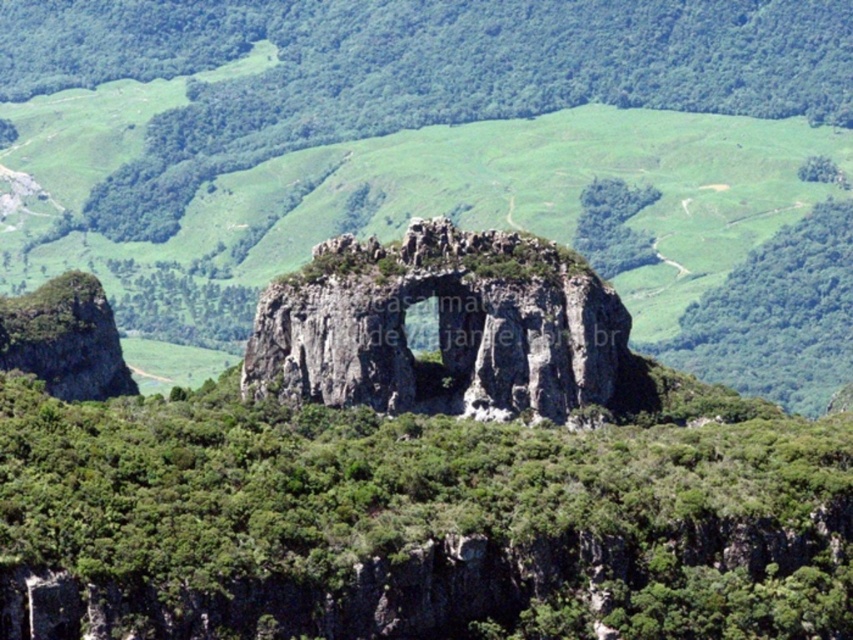
You are a hiker who wants to take a photo of the rugged stone arch at center and the green leafy vegetation at center. Which object should you focus on first if you want to capture both in a single frame without moving the camera?

The rugged stone arch at center has a greater height compared to the green leafy vegetation at center, so you should focus on the rugged stone arch at center first to ensure its full height is captured in the frame.

You are a hiker planning to pass through the arches in the landscape. You have a backpack that is 1.5 meters wide. Can you determine which arch, the rugged stone arch at center or the gray rocky arch at center, you can safely pass through with your backpack?

The rugged stone arch at center might be wider than gray rocky arch at center, so it is possible that the rugged stone arch at center can accommodate your backpack since it could be wider. However, without exact measurements, there is uncertainty. It would be safer to check both arches physically before proceeding.

You are standing at the center of the image and want to locate the rugged stone arch at center. According to the coordinates provided, in which direction should you look to find it?

The rugged stone arch at center is located at coordinates point (445, 156). Since you are at the center of the image, you should look slightly to the left and downward to find the rugged stone arch at center.